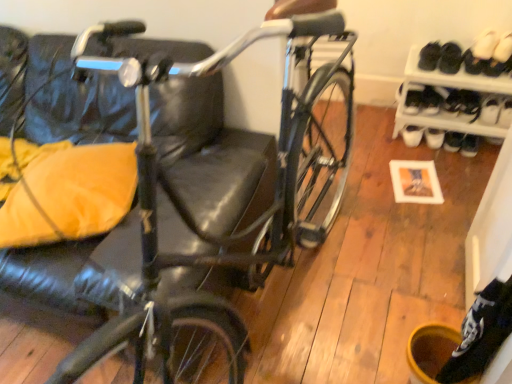
Question: Relative to shiny black bicycle at center, is white leather shoe at right in front or behind?

Choices:
 (A) behind
 (B) front

Answer: (A)

Question: Is point (490, 120) closer or farther from the camera than point (60, 36)?

Choices:
 (A) farther
 (B) closer

Answer: (A)

Question: Which is nearer to the black suede shoes at upper right, which appears as the 1th footwear when viewed from the left?

Choices:
 (A) shiny black bicycle at center
 (B) white leather shoe at right
 (C) white suede shoe at upper right, the third footwear when ordered from left to right
 (D) orange fabric pillow at left
 (E) white suede shoe at upper right, arranged as the 2th footwear when viewed from the right

Answer: (E)

Question: Which object is positioned farthest from the shiny black bicycle at center?

Choices:
 (A) black suede shoes at upper right, which appears as the 1th footwear when viewed from the left
 (B) white suede shoe at upper right, which is the first footwear in right-to-left order
 (C) orange fabric pillow at left
 (D) white suede shoe at upper right, the 2th footwear from the left
 (E) white plastic shoe rack at lower right

Answer: (B)